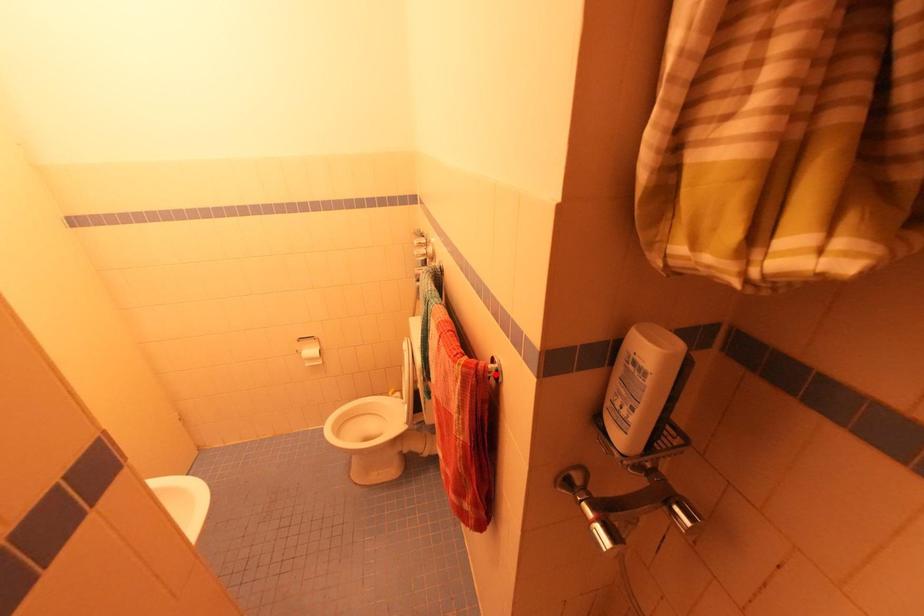
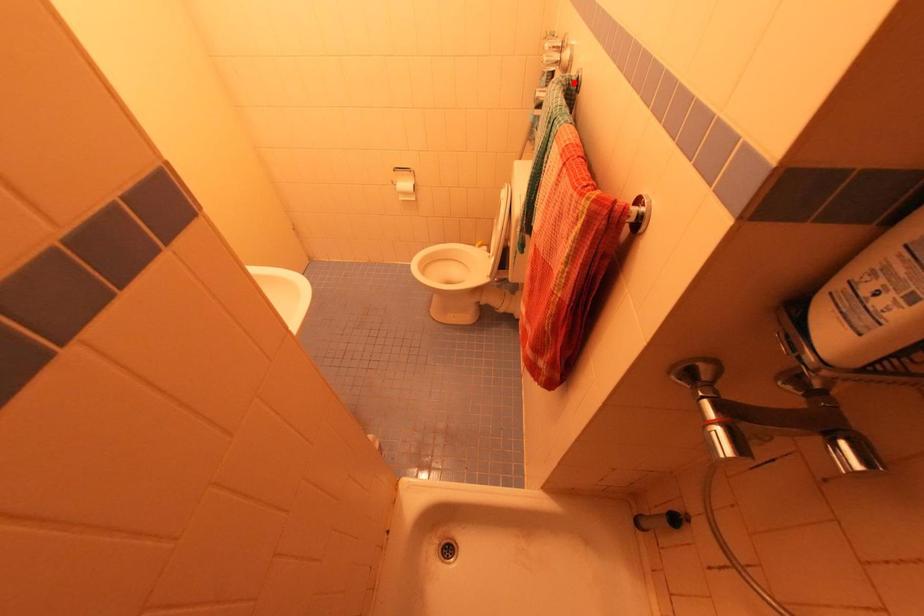
I am providing you with two images of the same scene from different viewpoints. A red point is marked on the first image and another point is marked on the second image. Are the points marked in image1 and image2 representing the same 3D position?

No